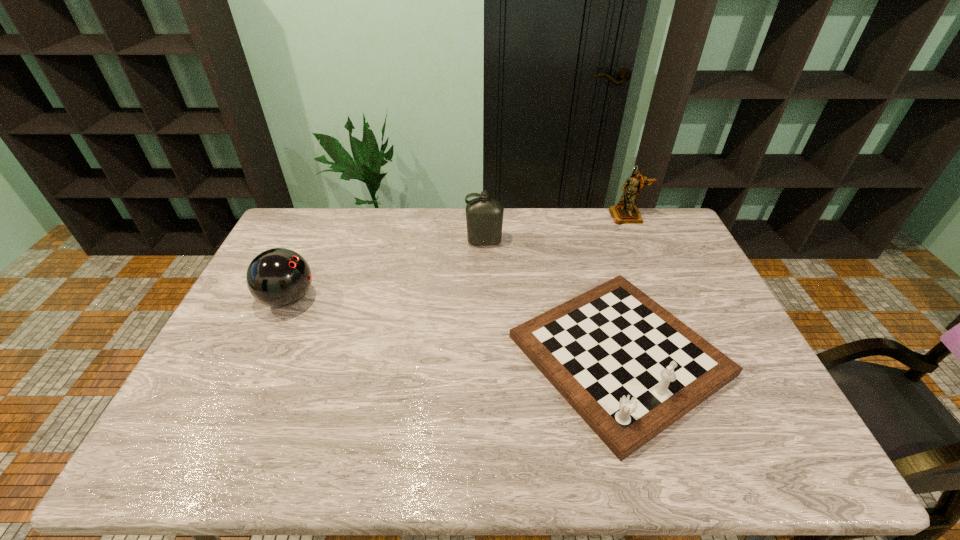
What are the coordinates of `figurine that is at the far edge` in the screenshot? It's located at (625, 212).

Locate an element on the screen. The height and width of the screenshot is (540, 960). bottle located in the far edge section of the desktop is located at coordinates (484, 217).

Locate an element on the screen. The width and height of the screenshot is (960, 540). object that is at the near edge is located at coordinates click(630, 369).

Identify the location of object that is at the left edge. This screenshot has width=960, height=540. (278, 277).

The image size is (960, 540). I want to click on figurine that is at the right edge, so click(625, 212).

The height and width of the screenshot is (540, 960). I want to click on gameboard positioned at the right edge, so click(630, 369).

Locate an element on the screen. This screenshot has width=960, height=540. object at the far right corner is located at coordinates (625, 212).

Locate an element on the screen. The image size is (960, 540). object at the near right corner is located at coordinates (630, 369).

Locate an element on the screen. This screenshot has height=540, width=960. vacant region at the far edge of the desktop is located at coordinates (573, 207).

The height and width of the screenshot is (540, 960). Identify the location of free space at the left edge. (263, 310).